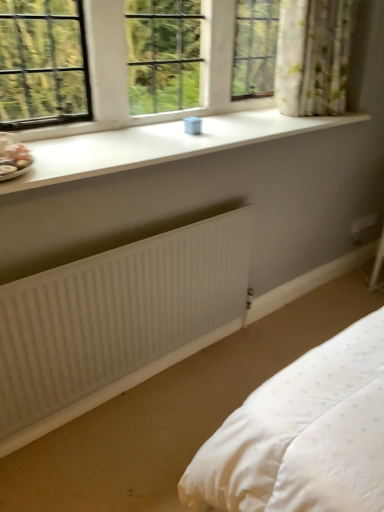
I want to click on free point in front of white ribbed radiator at lower center, so click(133, 437).